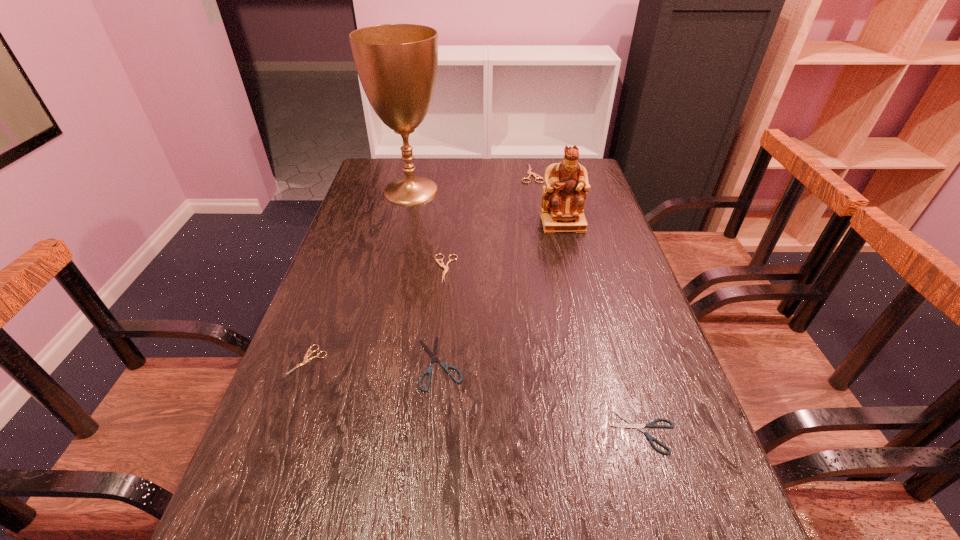
Where is `free space at the far left corner of the desktop`? free space at the far left corner of the desktop is located at coordinates (391, 162).

The width and height of the screenshot is (960, 540). I want to click on unoccupied area between the bigger black shears and the biggest beige shears, so click(486, 268).

Locate an element on the screen. The image size is (960, 540). vacant space that is in between the bigger black shears and the nearer black shears is located at coordinates (541, 397).

Identify the location of vacant space in between the trophy cup and the bigger black shears. Image resolution: width=960 pixels, height=540 pixels. (425, 276).

Locate an element on the screen. The image size is (960, 540). free space between the trophy cup and the fifth nearest object is located at coordinates (487, 207).

This screenshot has height=540, width=960. Find the location of `vacant area between the figurine and the left black shears`. vacant area between the figurine and the left black shears is located at coordinates (501, 293).

The image size is (960, 540). I want to click on empty space between the trophy cup and the second smallest beige shears, so click(428, 230).

Identify the location of object that can be found as the fourth closest to the leftmost beige shears. (633, 425).

Identify which object is the sixth closest to the tallest object. Please provide its 2D coordinates. Your answer should be formatted as a tuple, i.e. [(x, y)], where the tuple contains the x and y coordinates of a point satisfying the conditions above.

[(633, 425)]

Identify which shears is the fourth closest to the left black shears. Please provide its 2D coordinates. Your answer should be formatted as a tuple, i.e. [(x, y)], where the tuple contains the x and y coordinates of a point satisfying the conditions above.

[(530, 173)]